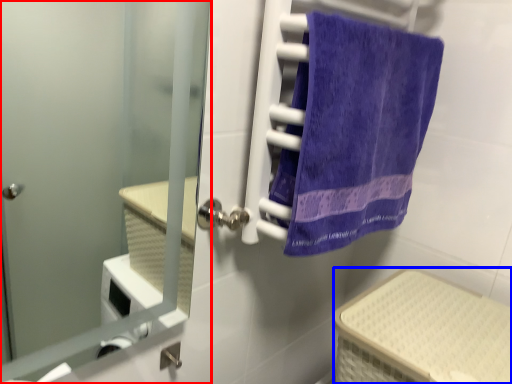
Question: Which point is further to the camera, door (highlighted by a red box) or basket (highlighted by a blue box)?

Choices:
 (A) door
 (B) basket

Answer: (B)